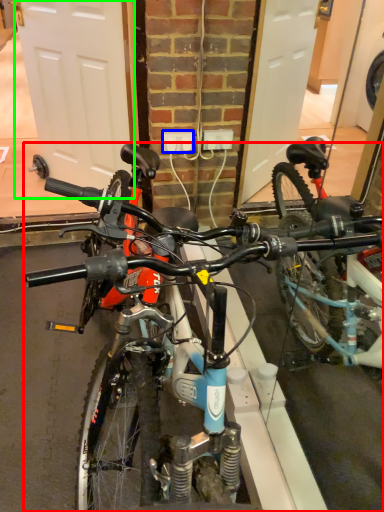
Question: Considering the real-world distances, which object is closest to bicycle (highlighted by a red box)? power outlet (highlighted by a blue box) or garage door (highlighted by a green box).

Choices:
 (A) power outlet
 (B) garage door

Answer: (A)